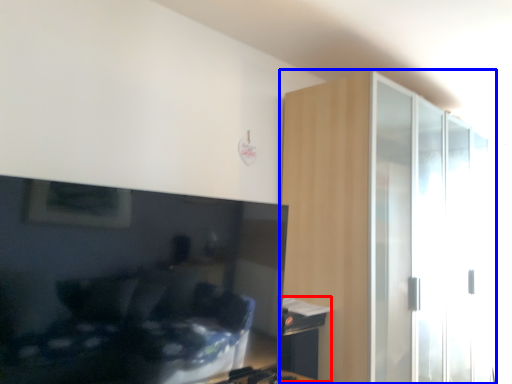
Question: Among these objects, which one is nearest to the camera, table (highlighted by a red box) or dresser (highlighted by a blue box)?

Choices:
 (A) table
 (B) dresser

Answer: (B)